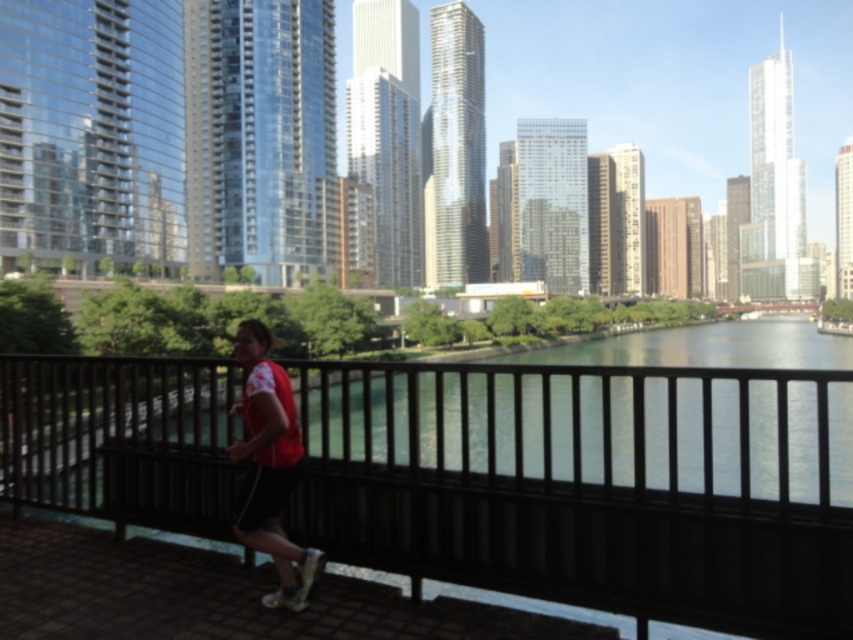
Between black wood railing at center and red matte shirt at center, which one has less height?

With less height is red matte shirt at center.

Does point (670, 580) come behind point (268, 436)?

That is False.

Identify the location of black wood railing at center. (590, 484).